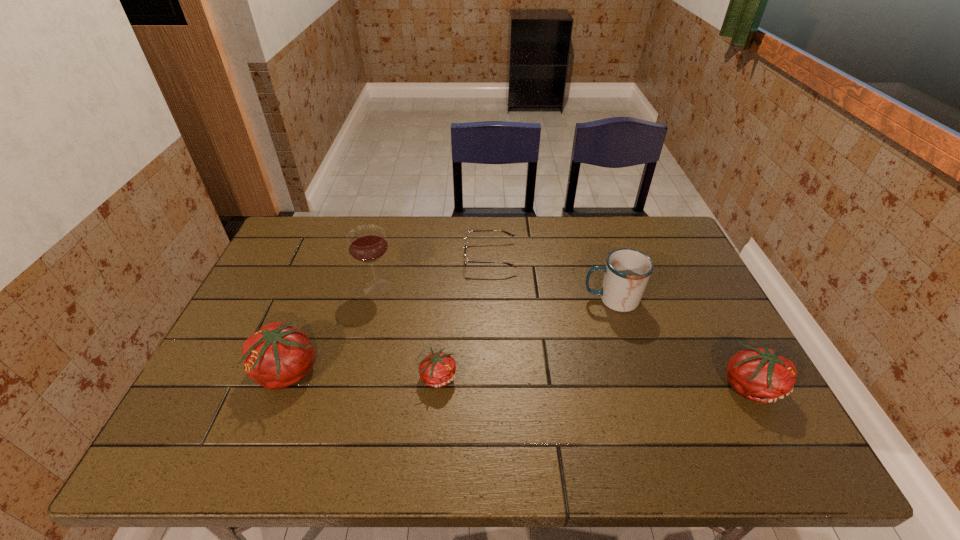
Find the location of a particular element. This screenshot has width=960, height=540. free spot located on the right of the leftmost tomato is located at coordinates (477, 372).

You are a GUI agent. You are given a task and a screenshot of the screen. Output one action in this format:
    pyautogui.click(x=<x>, y=<y>)
    Task: Click on the free space located on the back of the shortest tomato
    The image size is (960, 540).
    Given the screenshot: What is the action you would take?
    pyautogui.click(x=443, y=330)

Find the location of a particular element. This screenshot has height=540, width=960. vacant space located on the left of the fourth tallest object is located at coordinates (697, 384).

Where is `free region located on the front-facing side of the spectacles`? This screenshot has width=960, height=540. free region located on the front-facing side of the spectacles is located at coordinates (442, 257).

Where is `vacant space located on the front-facing side of the spectacles`? This screenshot has height=540, width=960. vacant space located on the front-facing side of the spectacles is located at coordinates (347, 257).

Image resolution: width=960 pixels, height=540 pixels. In order to click on free region located on the front-facing side of the spectacles in this screenshot , I will do `click(368, 257)`.

The image size is (960, 540). What are the coordinates of `blank space located 0.140m on the front of the tallest object` in the screenshot? It's located at (364, 337).

The height and width of the screenshot is (540, 960). I want to click on vacant region located 0.380m on the handle side of the second object from right to left, so click(x=452, y=300).

Identify the location of free point located 0.130m on the handle side of the second object from right to left. This screenshot has height=540, width=960. (538, 300).

At what (x,y) coordinates should I click in order to perform the action: click on vacant space located 0.190m on the handle side of the second object from right to left. Please return your answer as a coordinate pair (x, y). This screenshot has height=540, width=960. Looking at the image, I should click on (517, 300).